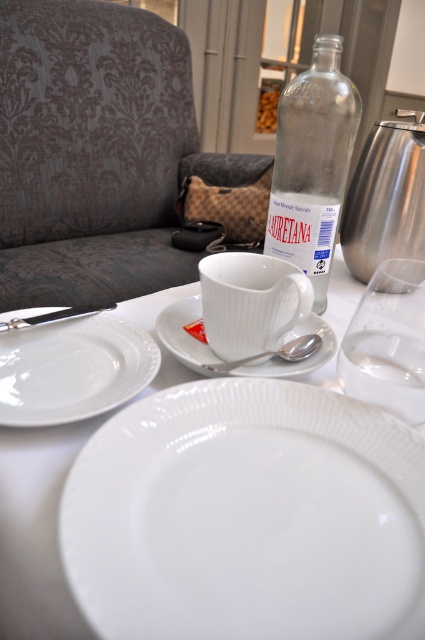
Question: Which object appears farthest from the camera in this image?

Choices:
 (A) white glossy platter at center
 (B) brushed metal teapot at upper right
 (C) shiny silver knife at left
 (D) silver metallic spoon at center

Answer: (B)

Question: Is white glossy platter at lower left to the left of brushed metal teapot at upper right from the viewer's perspective?

Choices:
 (A) yes
 (B) no

Answer: (A)

Question: Is transparent glass bottle at upper center positioned behind shiny silver knife at left?

Choices:
 (A) no
 (B) yes

Answer: (B)

Question: Which is nearer to the white ceramic saucer at center?

Choices:
 (A) shiny silver knife at left
 (B) white glossy platter at center

Answer: (A)

Question: Can you confirm if transparent glass bottle at upper center is positioned to the right of shiny silver knife at left?

Choices:
 (A) no
 (B) yes

Answer: (B)

Question: Which is farther from the shiny silver knife at left?

Choices:
 (A) white glossy platter at center
 (B) dark gray damask couch at upper left
 (C) transparent glass bottle at upper center

Answer: (B)